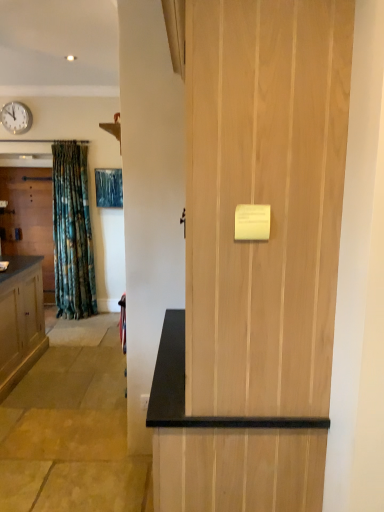
Question: Is white plastic clock at upper left oriented away from matte wood door at left, arranged as the 2th door when viewed from the right?

Choices:
 (A) no
 (B) yes

Answer: (A)

Question: Is matte wood door at left, which ranks as the first door in left-to-right order, inside white plastic clock at upper left?

Choices:
 (A) no
 (B) yes

Answer: (A)

Question: Is white plastic clock at upper left in front of matte wood door at left, arranged as the 2th door when viewed from the right?

Choices:
 (A) no
 (B) yes

Answer: (B)

Question: Is white plastic clock at upper left smaller than matte wood door at left, which ranks as the 1th door in back-to-front order?

Choices:
 (A) no
 (B) yes

Answer: (B)

Question: Is white plastic clock at upper left to the left of matte wood door at left, the 2th door in the front-to-back sequence, from the viewer's perspective?

Choices:
 (A) no
 (B) yes

Answer: (A)

Question: Is point (263, 117) positioned closer to the camera than point (8, 201)?

Choices:
 (A) farther
 (B) closer

Answer: (B)

Question: From a real-world perspective, is natural wood door at center, the second door positioned from the back, above or below matte wood door at left, the 2th door in the front-to-back sequence?

Choices:
 (A) below
 (B) above

Answer: (B)

Question: Is natural wood door at center, the first door positioned from the front, inside the boundaries of matte wood door at left, which ranks as the 1th door in back-to-front order, or outside?

Choices:
 (A) outside
 (B) inside

Answer: (A)

Question: Based on their sizes in the image, would you say natural wood door at center, the first door positioned from the front, is bigger or smaller than matte wood door at left, which ranks as the 1th door in back-to-front order?

Choices:
 (A) big
 (B) small

Answer: (A)

Question: From the image's perspective, is natural wood door at center, the first door when ordered from right to left, located above or below white plastic clock at upper left?

Choices:
 (A) above
 (B) below

Answer: (B)

Question: In terms of width, does natural wood door at center, the first door positioned from the front, look wider or thinner when compared to white plastic clock at upper left?

Choices:
 (A) thin
 (B) wide

Answer: (B)

Question: From a real-world perspective, relative to white plastic clock at upper left, is natural wood door at center, the second door positioned from the back, vertically above or below?

Choices:
 (A) above
 (B) below

Answer: (B)

Question: In terms of size, does natural wood door at center, the first door positioned from the front, appear bigger or smaller than white plastic clock at upper left?

Choices:
 (A) small
 (B) big

Answer: (B)

Question: Would you say white plastic clock at upper left is inside or outside matte wood door at left, the 2th door in the front-to-back sequence?

Choices:
 (A) inside
 (B) outside

Answer: (B)

Question: From a real-world perspective, is white plastic clock at upper left above or below matte wood door at left, which ranks as the first door in left-to-right order?

Choices:
 (A) above
 (B) below

Answer: (A)